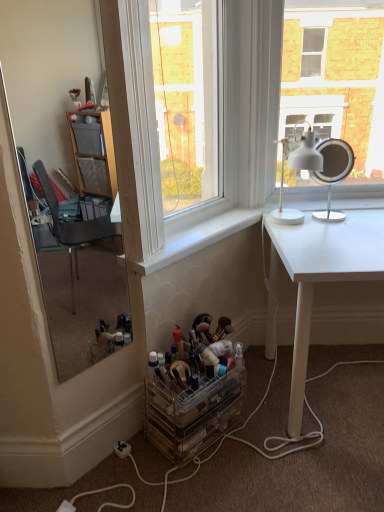
Question: Is white plastic table lamp at upper right, which is counted as the second table lamp, starting from the left, to the left of white matte table lamp at upper right, the second table lamp positioned from the right, from the viewer's perspective?

Choices:
 (A) no
 (B) yes

Answer: (A)

Question: Can you confirm if white plastic table lamp at upper right, which is counted as the second table lamp, starting from the left, is wider than white matte table lamp at upper right, the 1th table lamp positioned from the left?

Choices:
 (A) no
 (B) yes

Answer: (A)

Question: Is white plastic table lamp at upper right, which is counted as the first table lamp, starting from the right, to the right of white matte table lamp at upper right, the second table lamp positioned from the right, from the viewer's perspective?

Choices:
 (A) no
 (B) yes

Answer: (B)

Question: From a real-world perspective, is white plastic table lamp at upper right, which is counted as the first table lamp, starting from the right, located higher than white matte table lamp at upper right, the 1th table lamp positioned from the left?

Choices:
 (A) yes
 (B) no

Answer: (B)

Question: Is white plastic table lamp at upper right, which is counted as the first table lamp, starting from the right, in front of white matte table lamp at upper right, the second table lamp positioned from the right?

Choices:
 (A) yes
 (B) no

Answer: (B)

Question: Is white matte table lamp at upper right, the 1th table lamp positioned from the left, inside white plastic table lamp at upper right, which is counted as the second table lamp, starting from the left?

Choices:
 (A) no
 (B) yes

Answer: (A)

Question: Are white smooth window sill at center and clear glass mirror at left located far from each other?

Choices:
 (A) yes
 (B) no

Answer: (A)

Question: Does white smooth window sill at center have a larger size compared to clear glass mirror at left?

Choices:
 (A) no
 (B) yes

Answer: (A)

Question: From the image's perspective, is white smooth window sill at center located above clear glass mirror at left?

Choices:
 (A) yes
 (B) no

Answer: (B)

Question: From a real-world perspective, is white smooth window sill at center beneath clear glass mirror at left?

Choices:
 (A) yes
 (B) no

Answer: (A)

Question: Can we say white smooth window sill at center lies outside clear glass mirror at left?

Choices:
 (A) no
 (B) yes

Answer: (B)

Question: Does white smooth window sill at center have a greater width compared to clear glass mirror at left?

Choices:
 (A) yes
 (B) no

Answer: (A)

Question: Is clear glass window at center at the right side of clear acrylic makeup organizer at lower center?

Choices:
 (A) yes
 (B) no

Answer: (B)